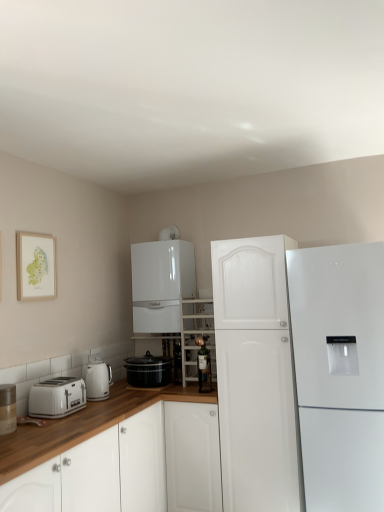
Locate an element on the screen. The image size is (384, 512). vacant space to the left of matte glass bottle at center is located at coordinates (177, 393).